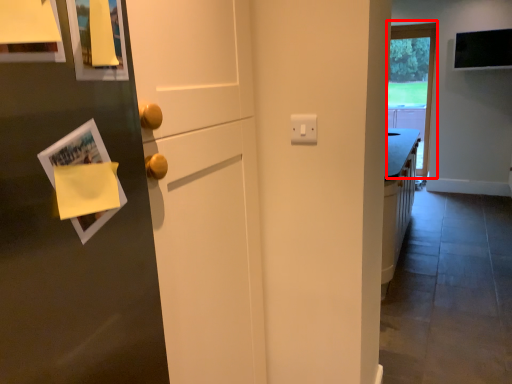
Question: From the image's perspective, where is window (annotated by the red box) located relative to magazine?

Choices:
 (A) above
 (B) below

Answer: (A)